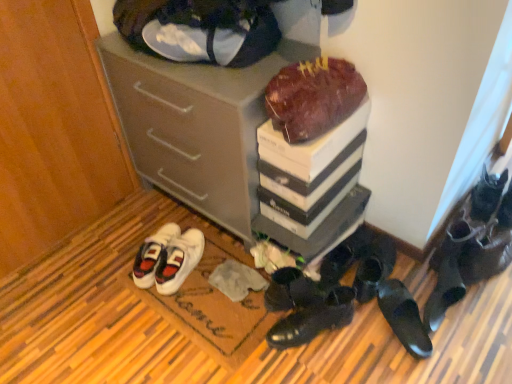
Locate an element on the screen. The image size is (512, 384). vacant area situated below white suede sneakers at lower left, marked as the first footwear in a left-to-right arrangement (from a real-world perspective) is located at coordinates (188, 265).